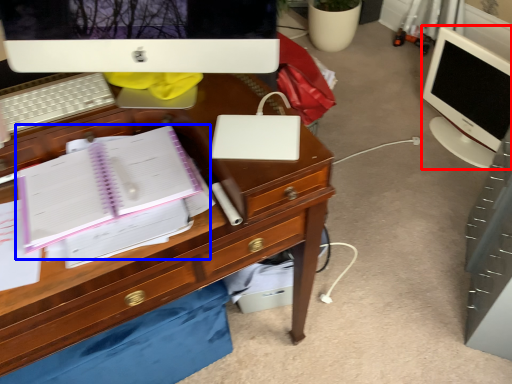
Question: Which of the following is the farthest to the observer, computer monitor (highlighted by a red box) or notebook (highlighted by a blue box)?

Choices:
 (A) computer monitor
 (B) notebook

Answer: (A)